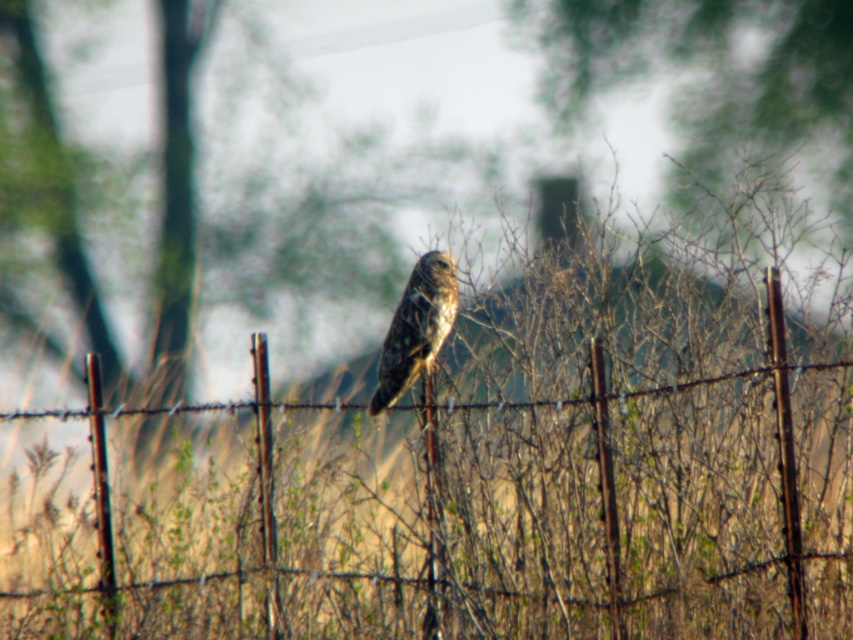
You are a photographer trying to capture the bird on the rusty wire fence at center. If you want to focus on the bird while keeping the fence in the frame, where should you position your camera relative to the fence?

The rusty wire fence at center is located at point (503, 490), so you should position your camera slightly to the right of the fence to ensure the bird is in focus while the fence remains within the frame.

You are a photographer aiming to capture a clear shot of the hawk. You notice two points in the image at coordinates point [685,442] and point [421,348]. Which point should you focus on to ensure the hawk is sharp?

You should focus on point [421,348] because point [685,442] is behind it, meaning the hawk is closer to point [421,348].

You are a photographer trying to capture the hawk on the barbed wire fence. You notice a point at coordinates point (503, 490). Where is this point located in relation to the hawk?

The point (503, 490) is located on the rusty wire fence at center where the hawk is perched.